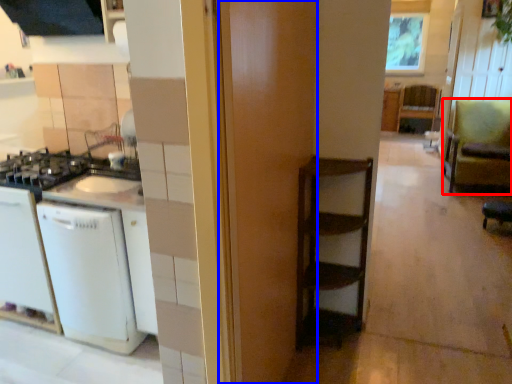
Question: Among these objects, which one is nearest to the camera, armchair (highlighted by a red box) or door (highlighted by a blue box)?

Choices:
 (A) armchair
 (B) door

Answer: (B)